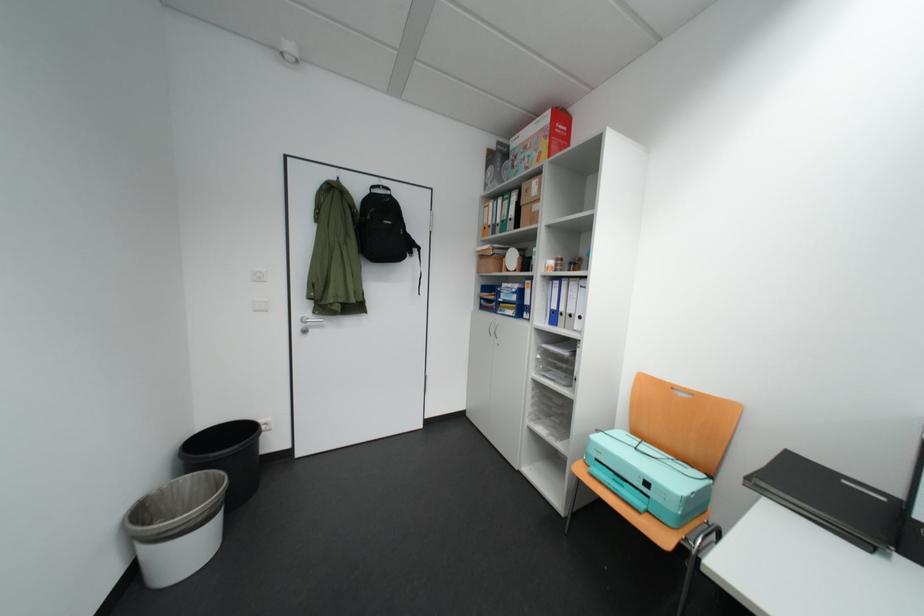
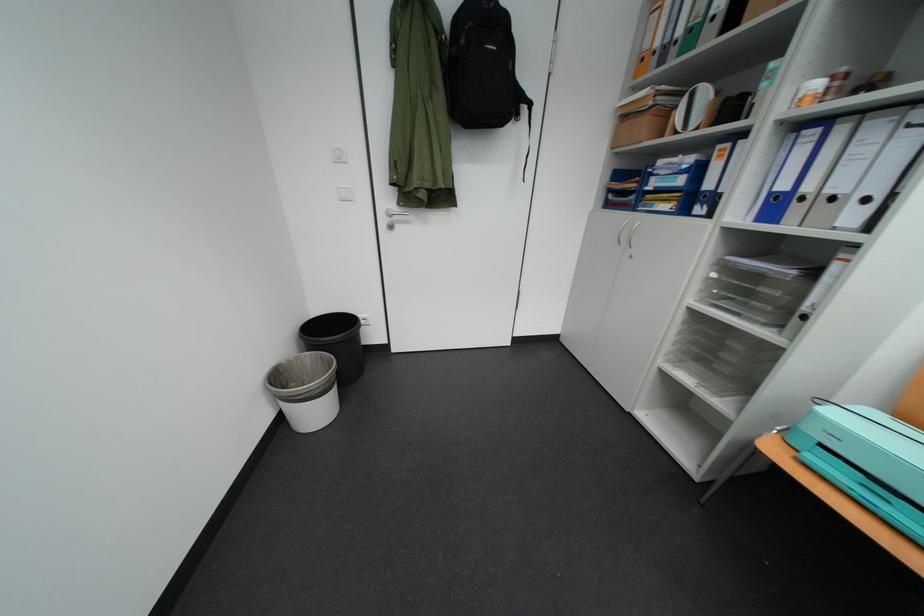
Find the pixel in the second image that matches pixel 572 447 in the first image.

(730, 403)